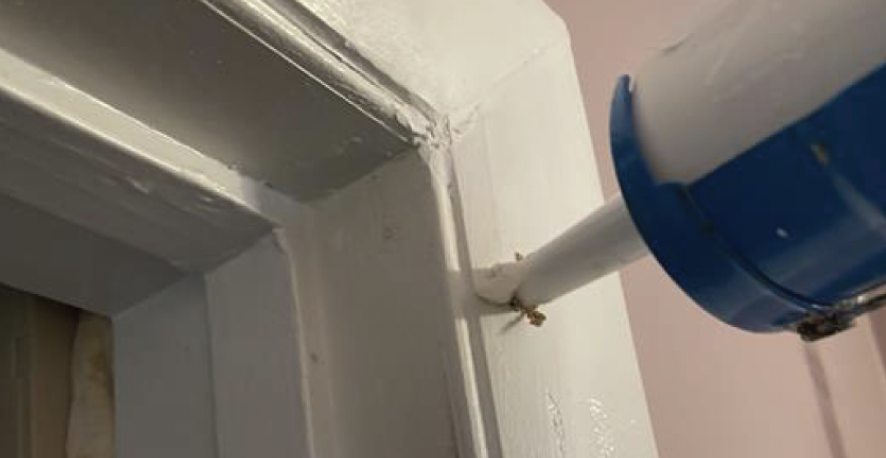
Find the location of a particular element. inside of door is located at coordinates (146, 334).